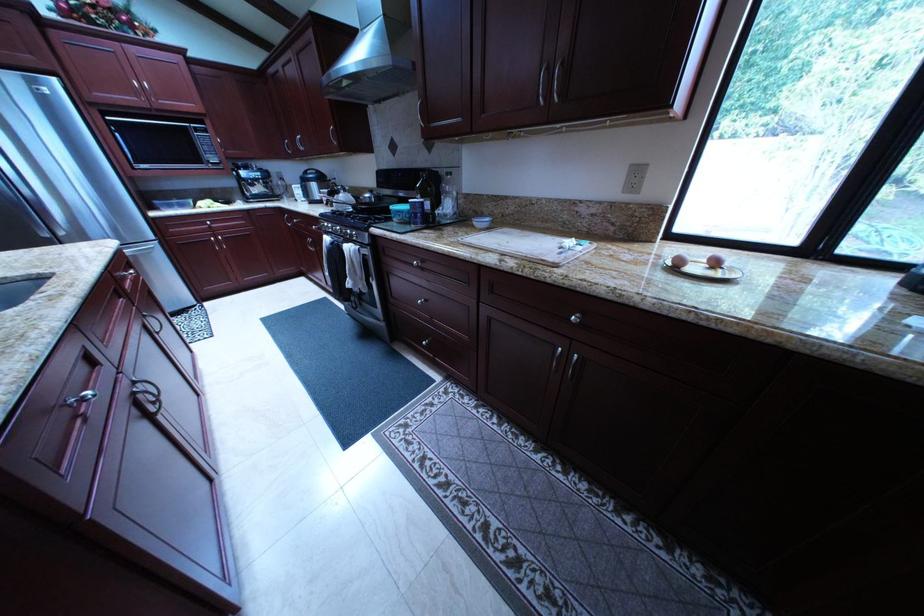
Where is `oven door handle`? This screenshot has width=924, height=616. oven door handle is located at coordinates (330, 240).